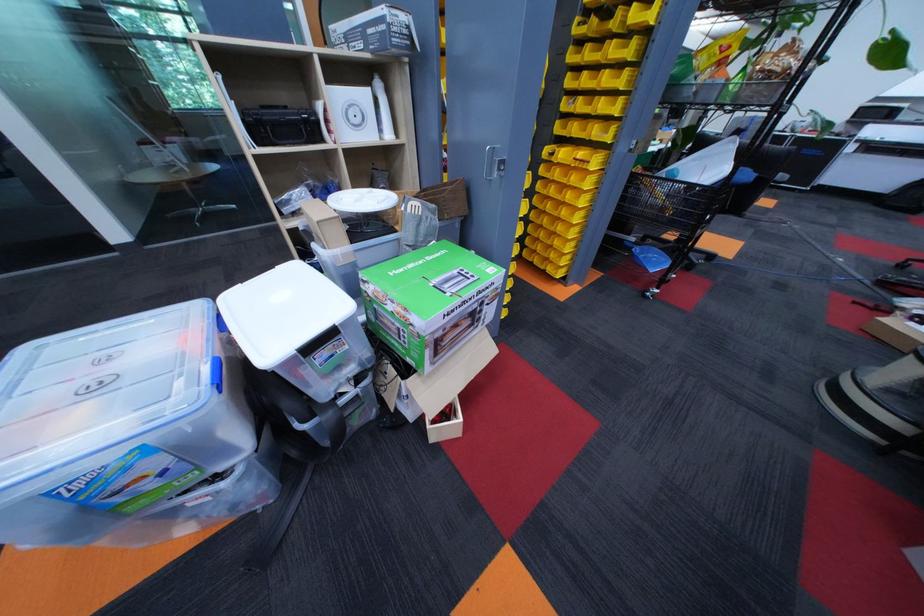
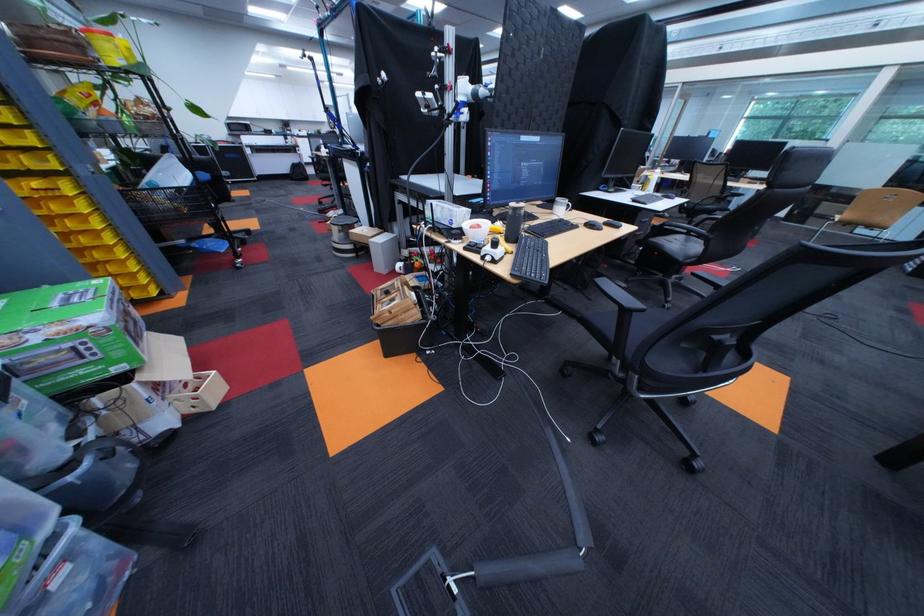
The point at (596, 203) is marked in the first image. Where is the corresponding point in the second image?

(111, 225)